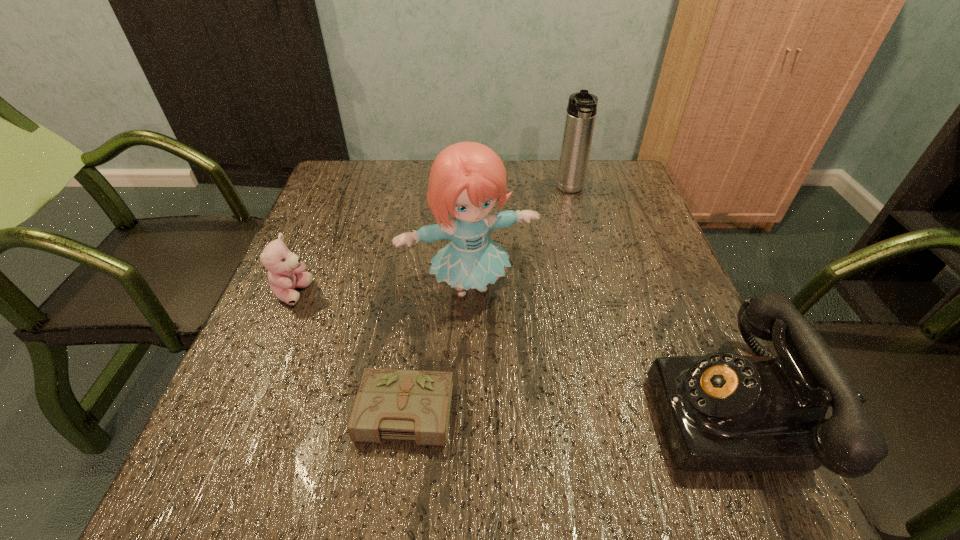
Locate an element on the screen. The height and width of the screenshot is (540, 960). vacant space situated at the face of the teddy bear is located at coordinates (363, 331).

Where is `object located at the far edge`? The width and height of the screenshot is (960, 540). object located at the far edge is located at coordinates (581, 111).

I want to click on diary at the near edge, so click(x=415, y=405).

Identify the location of telephone at the near edge. (723, 412).

Identify the location of object that is positioned at the left edge. (286, 273).

The width and height of the screenshot is (960, 540). I want to click on telephone that is at the right edge, so click(723, 412).

The width and height of the screenshot is (960, 540). Find the location of `thermos bottle that is at the right edge`. thermos bottle that is at the right edge is located at coordinates (581, 111).

This screenshot has width=960, height=540. I want to click on object that is at the far right corner, so click(x=581, y=111).

Image resolution: width=960 pixels, height=540 pixels. What are the coordinates of `object that is positioned at the near right corner` in the screenshot? It's located at (723, 412).

Identify the location of vacant space at the far edge of the desktop. Image resolution: width=960 pixels, height=540 pixels. (582, 204).